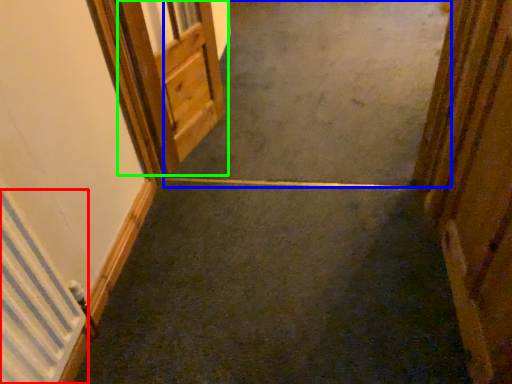
Question: Based on their relative distances, which object is nearer to radiator (highlighted by a red box)? Choose from concrete (highlighted by a blue box) and door (highlighted by a green box).

Choices:
 (A) concrete
 (B) door

Answer: (B)